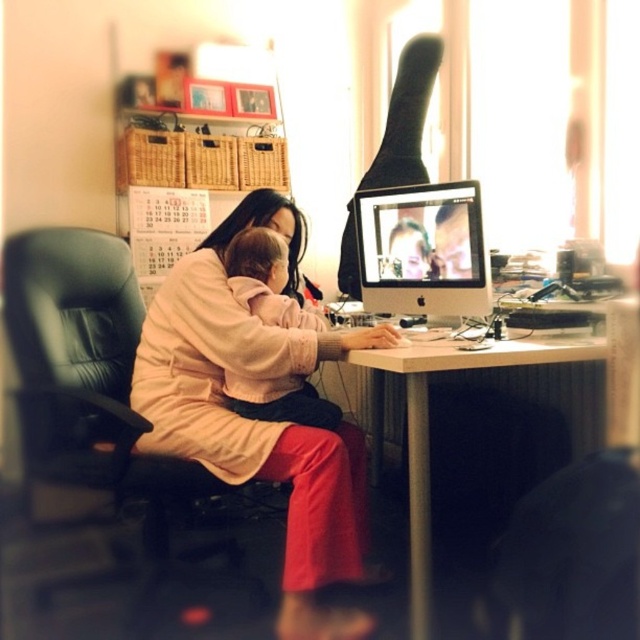
You are a delivery person who needs to place a small package on the desk without disturbing the baby. Given the white glossy table at center and the soft pink fabric baby at center, can you estimate if there is enough space on the table to place the package?

The white glossy table at center might be wider than the soft pink fabric baby at center, so there could be enough space to place the package without disturbing the baby.

You are planning to place a large plant pot that requires a sturdy surface. Given the scene, which object between the black leather chair at left and the white glossy table at center would be more suitable for placing the plant pot?

The black leather chair at left has a larger size compared to the white glossy table at center, so it would provide a more stable and sturdy surface for placing the large plant pot.